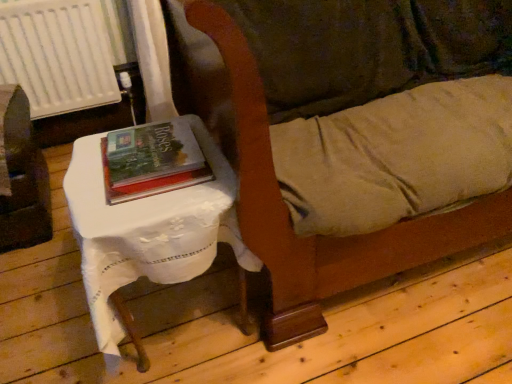
Locate an element on the screen. free space above hardcover book at center (from a real-world perspective) is located at coordinates (145, 145).